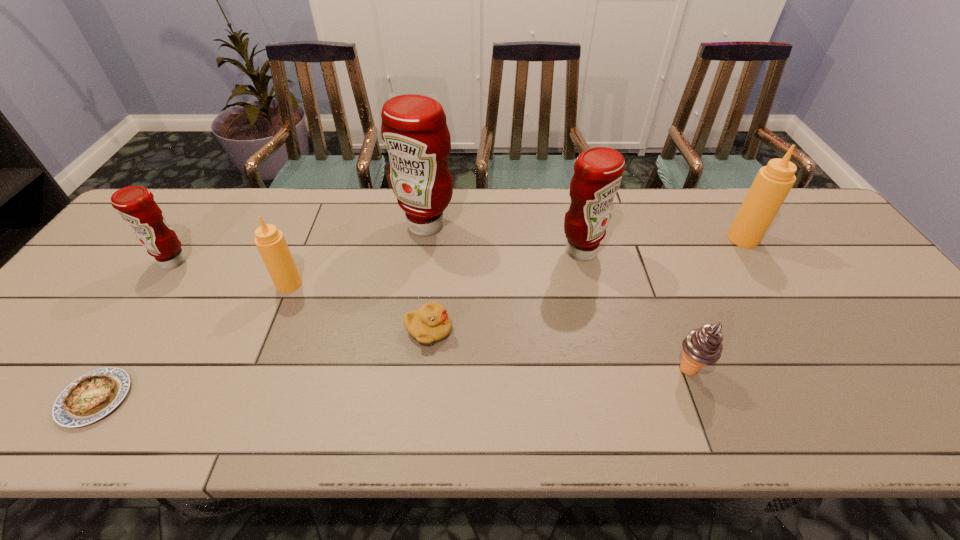
Where is `the seventh object from left to right`? This screenshot has height=540, width=960. the seventh object from left to right is located at coordinates (702, 346).

Where is `icecream`? This screenshot has height=540, width=960. icecream is located at coordinates (702, 346).

Where is `yellow duckling`? The image size is (960, 540). yellow duckling is located at coordinates (431, 323).

Find the location of a particular element. The height and width of the screenshot is (540, 960). the seventh tallest object is located at coordinates (431, 323).

Locate an element on the screen. quiche is located at coordinates (92, 396).

The width and height of the screenshot is (960, 540). What are the coordinates of `free spot located 0.090m on the right of the tallest condiment` in the screenshot? It's located at (486, 225).

The width and height of the screenshot is (960, 540). Find the location of `vacant space positioned on the front of the rightmost condiment`. vacant space positioned on the front of the rightmost condiment is located at coordinates (772, 285).

The width and height of the screenshot is (960, 540). I want to click on blank space located on the right of the second smallest red condiment, so click(680, 252).

You are a GUI agent. You are given a task and a screenshot of the screen. Output one action in this format:
    pyautogui.click(x=<x>, y=<y>)
    Task: Click on the vacant space situated on the back of the left tan condiment
    
    Given the screenshot: What is the action you would take?
    pyautogui.click(x=303, y=250)

You are a GUI agent. You are given a task and a screenshot of the screen. Output one action in this format:
    pyautogui.click(x=<x>, y=<y>)
    Task: Click on the free point located 0.170m on the back of the leftmost condiment
    This screenshot has height=540, width=960.
    Given the screenshot: What is the action you would take?
    pyautogui.click(x=207, y=213)